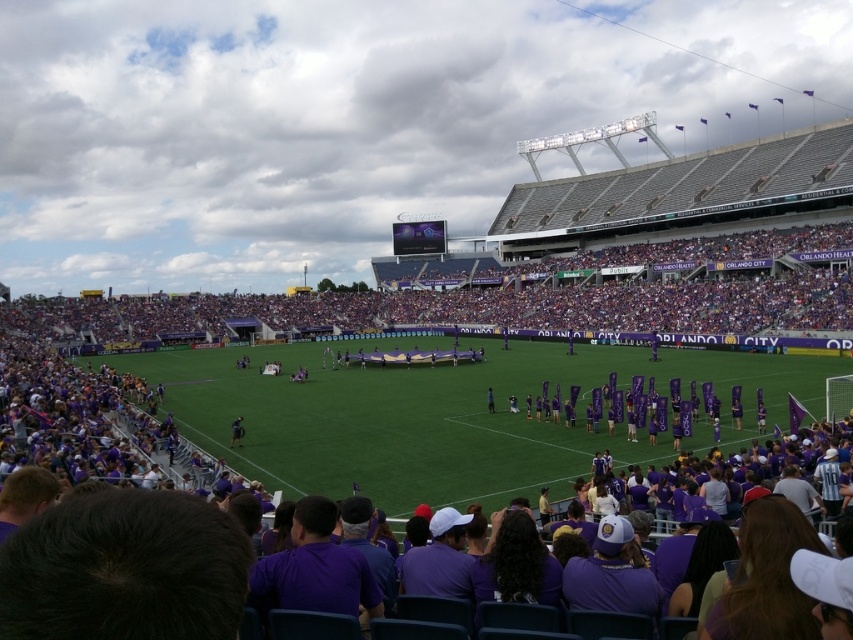
Question: Is green grass football field at center wider than dark blue jersey at center?

Choices:
 (A) no
 (B) yes

Answer: (B)

Question: Which object is closer to the camera taking this photo?

Choices:
 (A) dark blue jersey at center
 (B) green grass football field at center

Answer: (B)

Question: Does green grass football field at center have a smaller size compared to dark blue jersey at center?

Choices:
 (A) yes
 (B) no

Answer: (B)

Question: Is green grass football field at center in front of dark blue jersey at center?

Choices:
 (A) no
 (B) yes

Answer: (B)